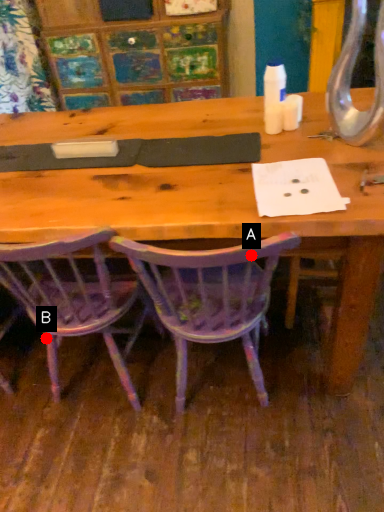
Question: Two points are circled on the image, labeled by A and B beside each circle. Among these points, which one is nearest to the camera?

Choices:
 (A) A is closer
 (B) B is closer

Answer: (A)